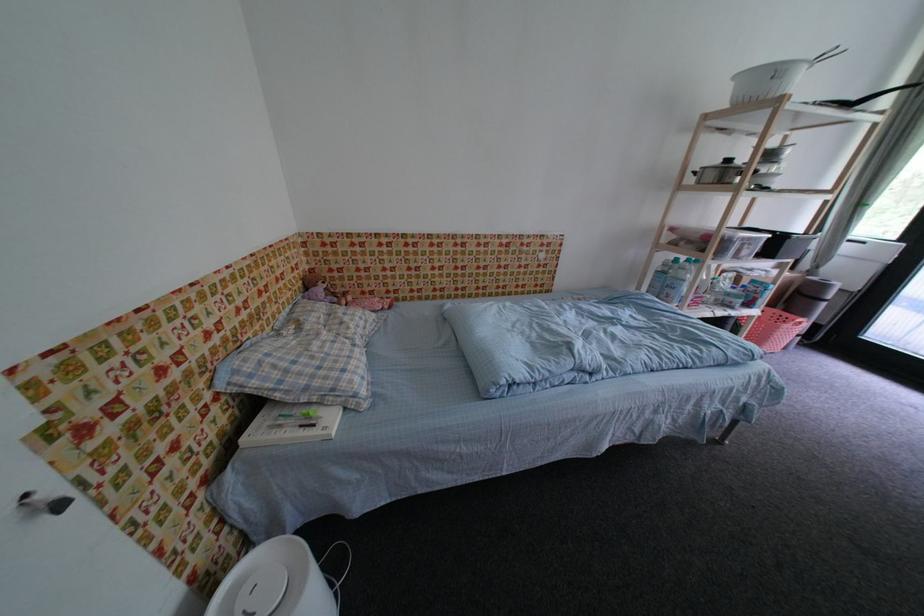
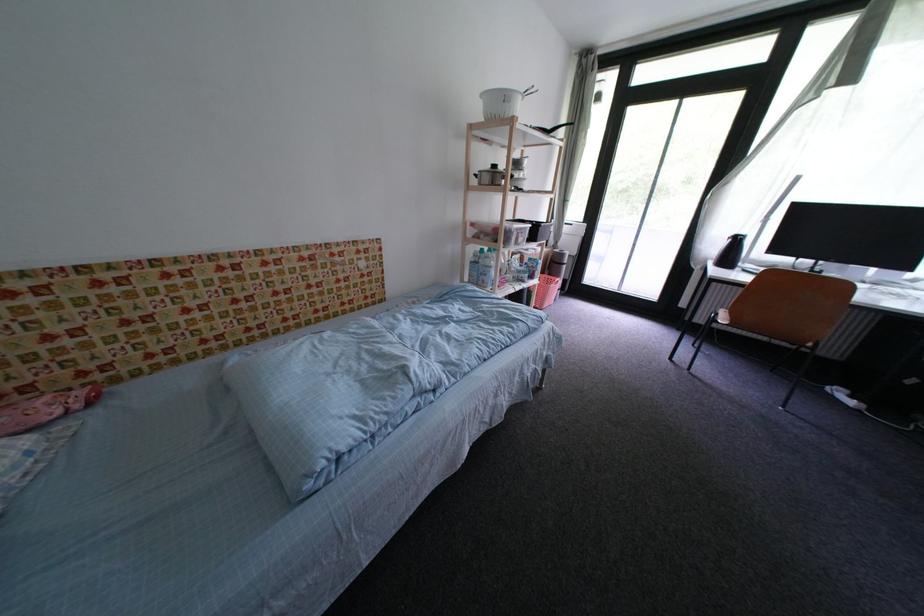
Find the pixel in the second image that matches the point at 736,163 in the first image.

(503, 169)